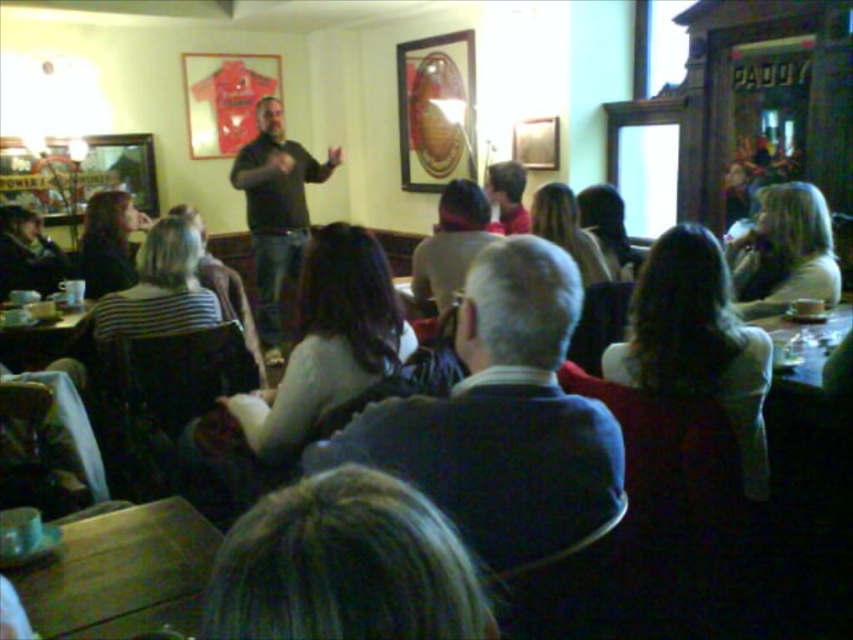
Question: Does black matte shirt at center have a greater width compared to wooden table at right?

Choices:
 (A) yes
 (B) no

Answer: (A)

Question: Is dark blue sweater at center behind wooden table at right?

Choices:
 (A) no
 (B) yes

Answer: (A)

Question: Which point is closer to the camera?

Choices:
 (A) (793, 376)
 (B) (444, 444)
 (C) (10, 576)
 (D) (270, 237)

Answer: (B)

Question: Can you confirm if dark blue sweater at center is wider than wooden table at lower left?

Choices:
 (A) no
 (B) yes

Answer: (B)

Question: Among these objects, which one is nearest to the camera?

Choices:
 (A) wooden table at lower left
 (B) wooden table at right

Answer: (A)

Question: Which point appears closest to the camera in this image?

Choices:
 (A) (409, 435)
 (B) (265, 124)

Answer: (A)